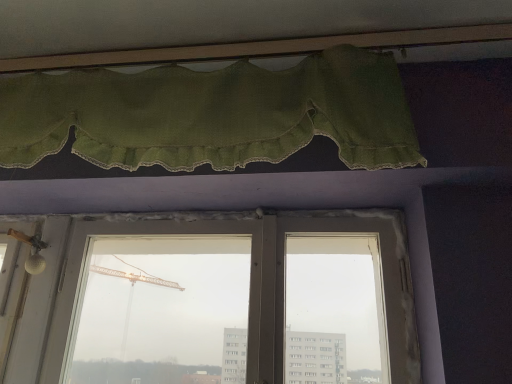
Question: From a real-world perspective, is transparent glass window at center physically located above or below green fabric curtain at upper center?

Choices:
 (A) below
 (B) above

Answer: (A)

Question: Would you say transparent glass window at center is to the left or to the right of green fabric curtain at upper center in the picture?

Choices:
 (A) right
 (B) left

Answer: (A)

Question: Does point (244, 225) appear closer or farther from the camera than point (181, 130)?

Choices:
 (A) closer
 (B) farther

Answer: (B)

Question: Do you think green fabric curtain at upper center is within transparent glass window at center, or outside of it?

Choices:
 (A) inside
 (B) outside

Answer: (B)

Question: In terms of height, does green fabric curtain at upper center look taller or shorter compared to transparent glass window at center?

Choices:
 (A) short
 (B) tall

Answer: (A)

Question: From the image's perspective, is green fabric curtain at upper center above or below transparent glass window at center?

Choices:
 (A) above
 (B) below

Answer: (A)

Question: Considering the positions of green fabric curtain at upper center and transparent glass window at center in the image, is green fabric curtain at upper center bigger or smaller than transparent glass window at center?

Choices:
 (A) small
 (B) big

Answer: (B)